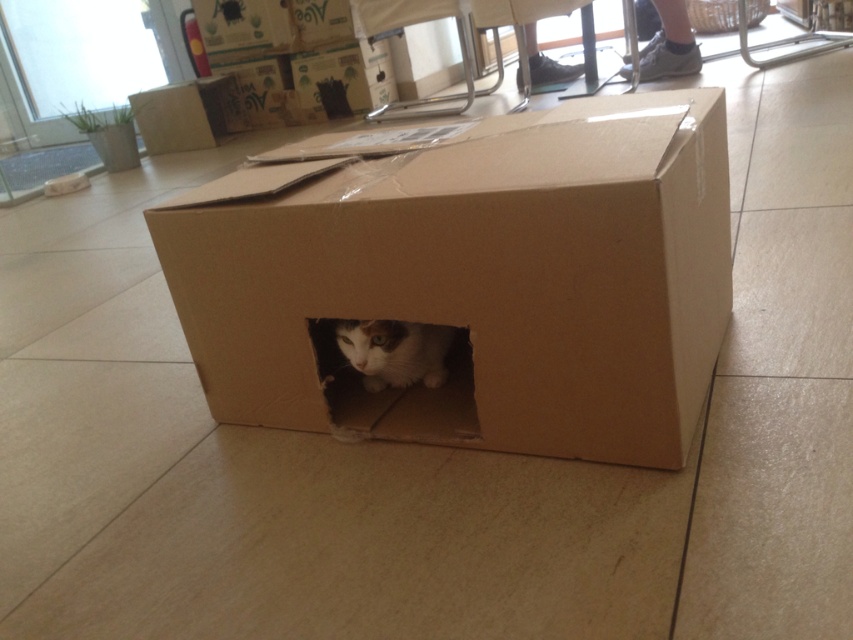
Question: Is cardboard box at center in front of white fur cat at center?

Choices:
 (A) no
 (B) yes

Answer: (A)

Question: Which point is closer to the camera?

Choices:
 (A) (265, 177)
 (B) (198, 145)

Answer: (A)

Question: Can you confirm if brown cardboard box at center is positioned above white fur cat at center?

Choices:
 (A) yes
 (B) no

Answer: (A)

Question: Which is nearer to the brown cardboard box at center?

Choices:
 (A) white fur cat at center
 (B) cardboard box at center

Answer: (A)

Question: Which object is closer to the camera taking this photo?

Choices:
 (A) cardboard box at center
 (B) white fur cat at center

Answer: (B)

Question: Can you confirm if brown cardboard box at center is smaller than cardboard box at center?

Choices:
 (A) yes
 (B) no

Answer: (B)